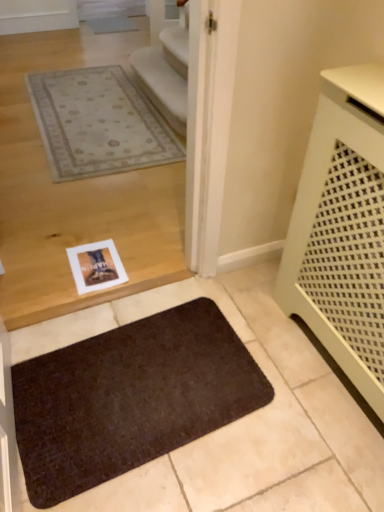
Question: Is brown textured mat at lower center to the left of white perforated radiator at right from the viewer's perspective?

Choices:
 (A) yes
 (B) no

Answer: (A)

Question: Can you confirm if brown textured mat at lower center is shorter than white perforated radiator at right?

Choices:
 (A) yes
 (B) no

Answer: (A)

Question: Is brown textured mat at lower center further to camera compared to white perforated radiator at right?

Choices:
 (A) no
 (B) yes

Answer: (B)

Question: Can you confirm if brown textured mat at lower center is smaller than white perforated radiator at right?

Choices:
 (A) no
 (B) yes

Answer: (B)

Question: From the image's perspective, is brown textured mat at lower center beneath white perforated radiator at right?

Choices:
 (A) no
 (B) yes

Answer: (B)

Question: Would you say brown textured mat at lower center contains white perforated radiator at right?

Choices:
 (A) no
 (B) yes

Answer: (A)

Question: Is brown textured mat at lower center at the back of white perforated radiator at right?

Choices:
 (A) no
 (B) yes

Answer: (A)

Question: Is white perforated radiator at right positioned in front of brown textured mat at lower center?

Choices:
 (A) yes
 (B) no

Answer: (A)

Question: Considering the relative sizes of white perforated radiator at right and brown textured mat at lower center in the image provided, is white perforated radiator at right smaller than brown textured mat at lower center?

Choices:
 (A) no
 (B) yes

Answer: (A)

Question: Can you confirm if white perforated radiator at right is thinner than brown textured mat at lower center?

Choices:
 (A) yes
 (B) no

Answer: (A)

Question: From the image's perspective, is white perforated radiator at right below brown textured mat at lower center?

Choices:
 (A) yes
 (B) no

Answer: (B)

Question: From a real-world perspective, is white perforated radiator at right located beneath brown textured mat at lower center?

Choices:
 (A) no
 (B) yes

Answer: (A)

Question: From a real-world perspective, is white perforated radiator at right physically located above or below brown textured mat at lower center?

Choices:
 (A) above
 (B) below

Answer: (A)